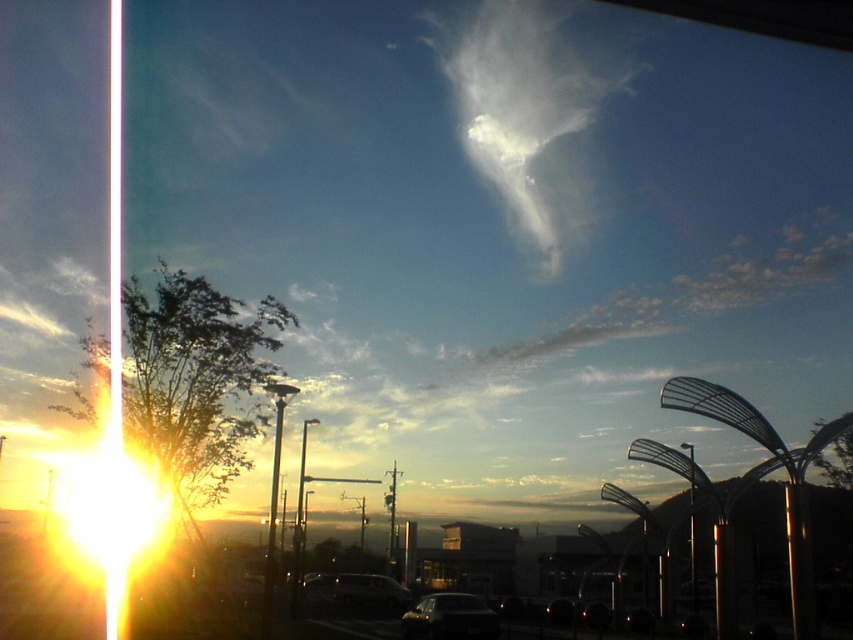
You are inside a car and looking out the window. You see a white fluffy cloud at upper center and a matte silver van at center. Which object is closer to the right side of the window?

→ The white fluffy cloud at upper center is to the right of the matte silver van at center, so it is closer to the right side of the window.

You are a passenger in the dark gray metallic car at lower center and want to exit the vehicle. Is the matte silver van at center blocking your way out?

The dark gray metallic car at lower center is bigger than the matte silver van at center, so the matte silver van at center is smaller and less likely to block your exit. However, the exact positioning and door location would determine accessibility, but based on size alone, the matte silver van at center may not fully obstruct your path.